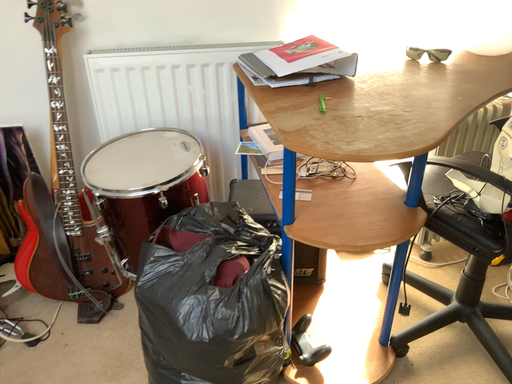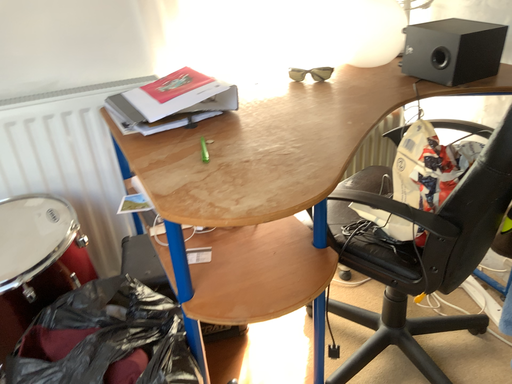
Question: How did the camera likely rotate when shooting the video?

Choices:
 (A) rotated left
 (B) rotated right

Answer: (B)